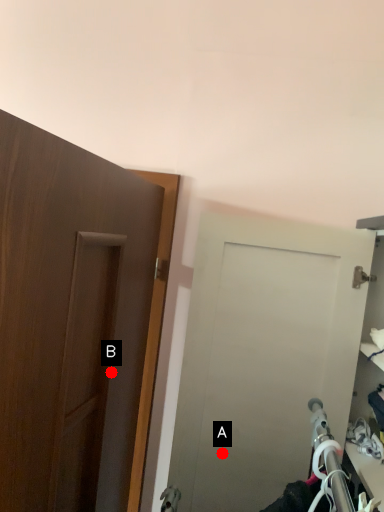
Question: Two points are circled on the image, labeled by A and B beside each circle. Which point is farther to the camera?

Choices:
 (A) A is further
 (B) B is further

Answer: (A)